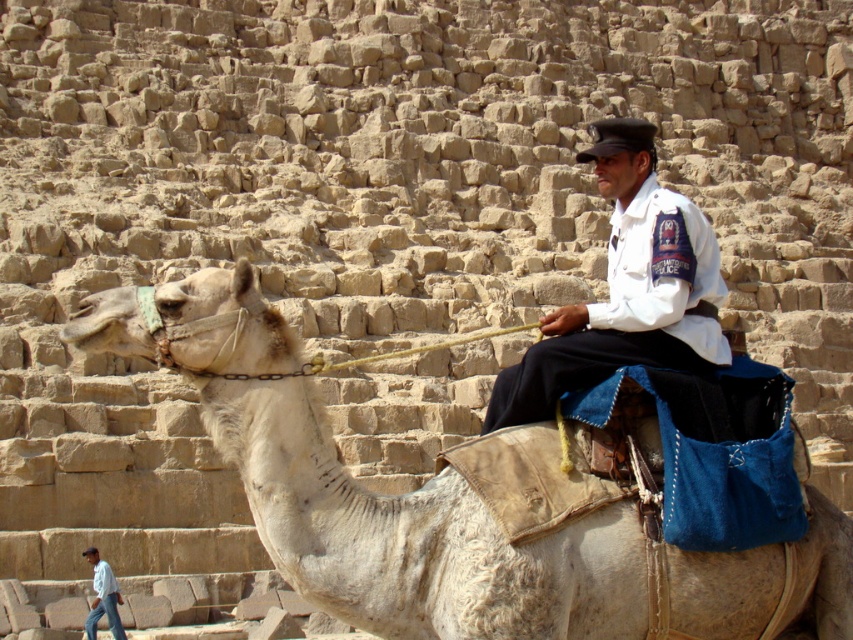
From the picture: You are standing in front of the pyramid and want to determine which of the two points, point (454, 636) or point (699, 369), is closer to you. Based on the scene, which point is nearer?

Point (454, 636) is closer to the viewer than point (699, 369).

You are a tour guide standing at the base of the pyramid. You notice a tourist wearing a white uniform at center who is 24.40 meters away. Can you safely walk towards them without any obstacles? Please explain your reasoning based on the scene description.

The white uniform at center is 24.40 meters away from the camera. Since the scene describes a large stone structure with a steep incline and no mention of obstacles between you and the tourist, it is likely safe to walk towards them. However, be cautious of the terrain and any potential steps or uneven surfaces near the pyramid base.